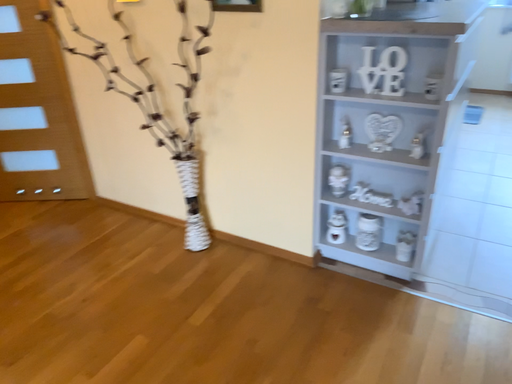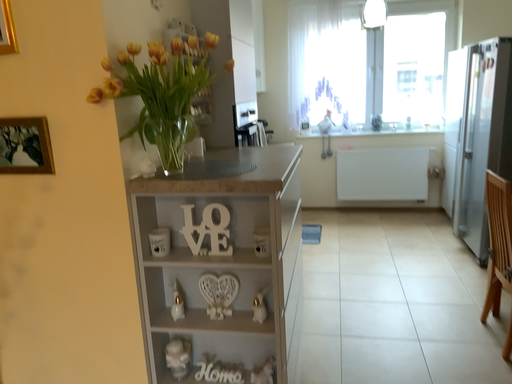
Question: How did the camera likely rotate when shooting the video?

Choices:
 (A) rotated downward
 (B) rotated upward

Answer: (B)